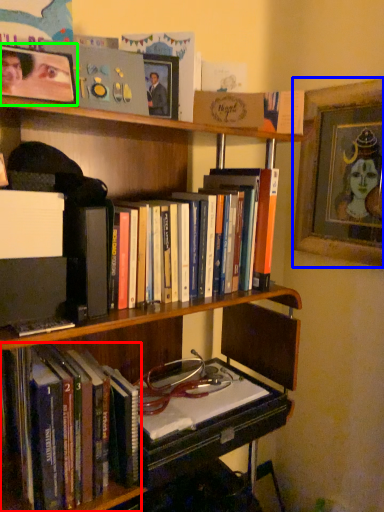
Question: Based on their relative distances, which object is farther from book (highlighted by a red box)? Choose from picture frame (highlighted by a blue box) and picture frame (highlighted by a green box).

Choices:
 (A) picture frame
 (B) picture frame

Answer: (A)